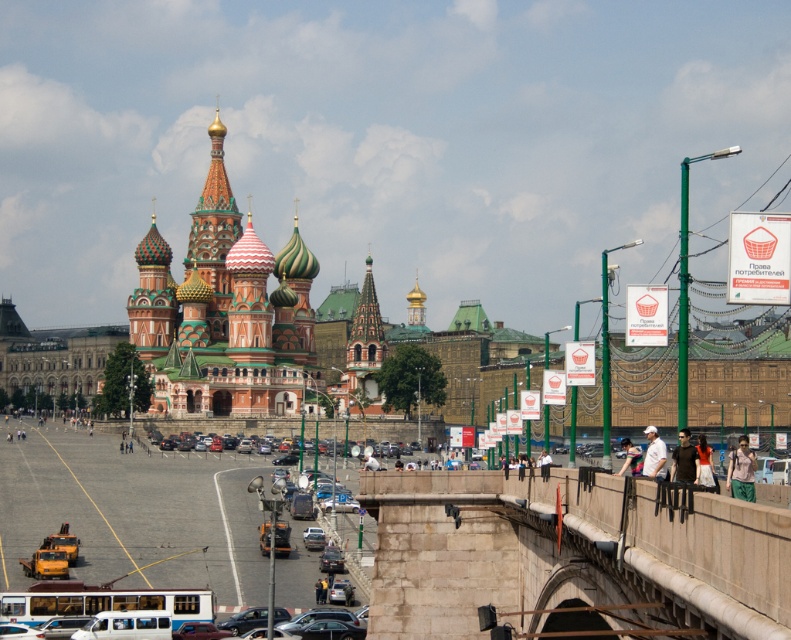
Question: Can you confirm if stone bridge at center is bigger than pink fabric shirt at upper right?

Choices:
 (A) yes
 (B) no

Answer: (A)

Question: Which point is closer to the camera taking this photo?

Choices:
 (A) [x=785, y=596]
 (B) [x=629, y=460]

Answer: (A)

Question: Among these points, which one is farthest from the camera?

Choices:
 (A) pos(645,472)
 (B) pos(687,458)
 (C) pos(615,500)

Answer: (A)

Question: Can you confirm if brown leather jacket at lower right is bigger than white cotton shirt at right?

Choices:
 (A) no
 (B) yes

Answer: (A)

Question: Can you confirm if stone bridge at center is positioned below white cotton shirt at right?

Choices:
 (A) yes
 (B) no

Answer: (A)

Question: Which of these objects is positioned farthest from the white cotton shirt at right?

Choices:
 (A) pink fabric shirt at upper right
 (B) light blue denim jeans at lower right

Answer: (A)